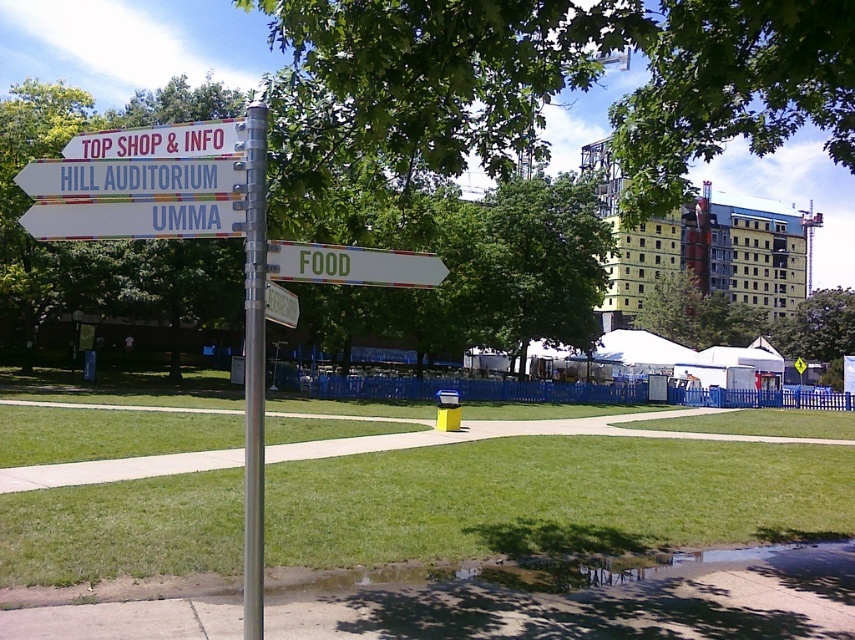
Consider the image. You are standing at the metal pole with directional signs and want to take a photo of both the green leafy tree at center and the metallic silver sign at center. Which object should you adjust your camera angle to focus on first to ensure both are in frame?

The green leafy tree at center is located above the metallic silver sign at center, so you should focus on the green leafy tree at center first to ensure both are in frame by adjusting your angle upwards.

You are a student walking on the green grass at center and want to reach the silver metallic pole at center. Which direction should you move to get closer to the pole?

The silver metallic pole at center is behind the green grass at center, so you should move backward to reach it.

You are a gardener who needs to place a new bench between the green leafy tree at center and the metallic silver sign at center. Which side of the bench should face the wider object?

The green leafy tree at center is wider than the metallic silver sign at center, so the bench should face the green leafy tree at center.